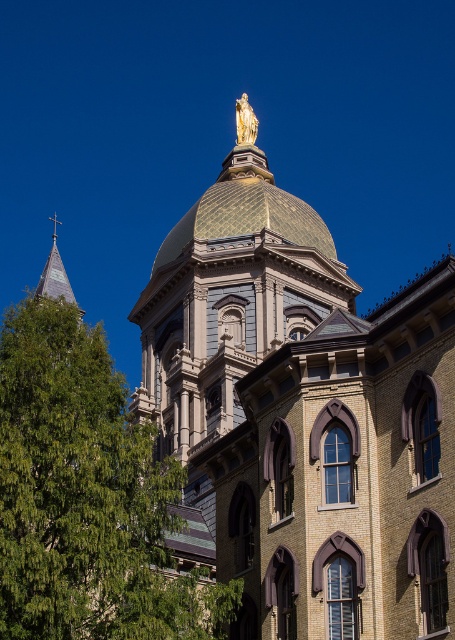
Question: Does green leafy tree at lower left have a lesser width compared to gold textured dome at center?

Choices:
 (A) yes
 (B) no

Answer: (B)

Question: Does green leafy tree at lower left appear on the right side of gold textured dome at center?

Choices:
 (A) no
 (B) yes

Answer: (A)

Question: Which of the following is the farthest from the observer?

Choices:
 (A) gold textured dome at center
 (B) green leafy tree at lower left

Answer: (A)

Question: Can you confirm if green leafy tree at lower left is bigger than gold textured dome at center?

Choices:
 (A) no
 (B) yes

Answer: (B)

Question: Which point is closer to the camera?

Choices:
 (A) gold textured dome at center
 (B) green leafy tree at lower left

Answer: (B)